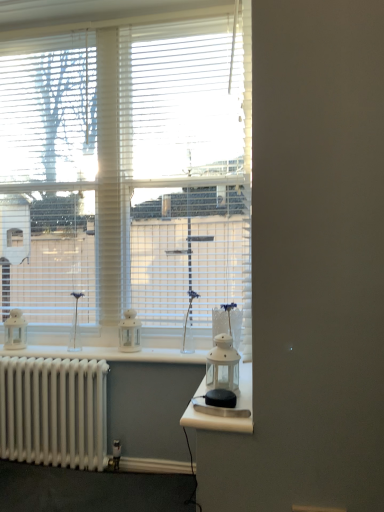
The image size is (384, 512). I want to click on free location above white blinds at upper center, which ranks as the 1th window in left-to-right order (from a real-world perspective), so click(103, 20).